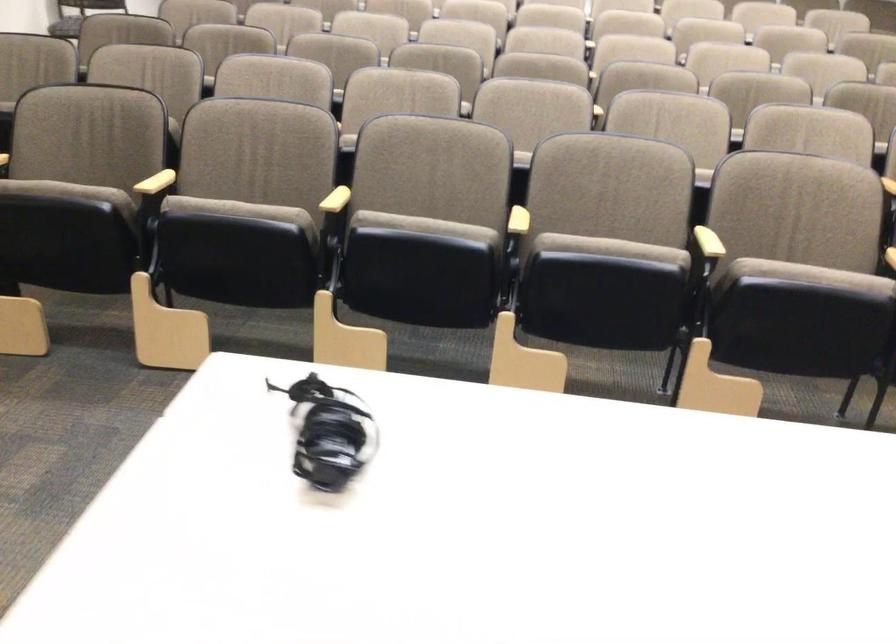
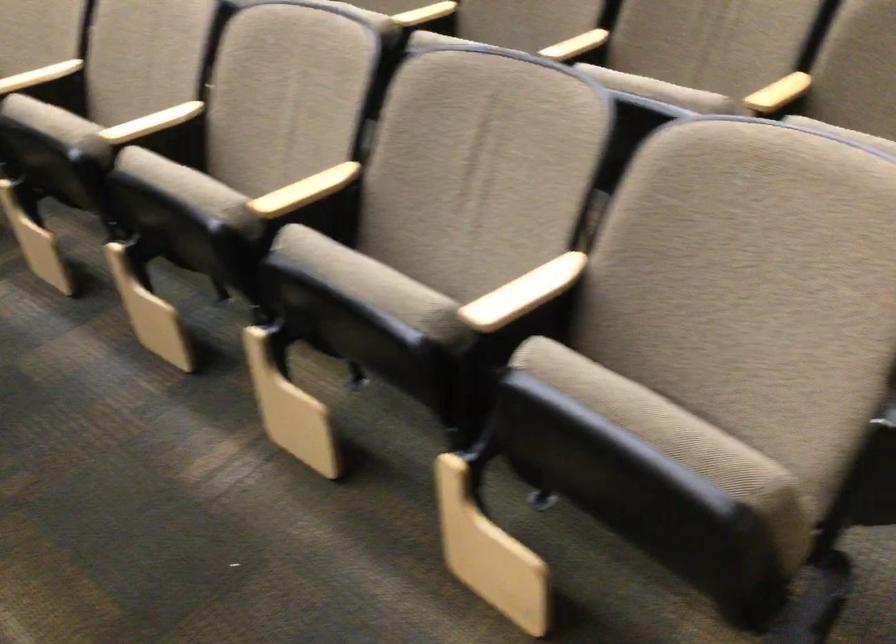
Which direction would the cameraman need to move to produce the second image?

The cameraman walked toward right, forward.